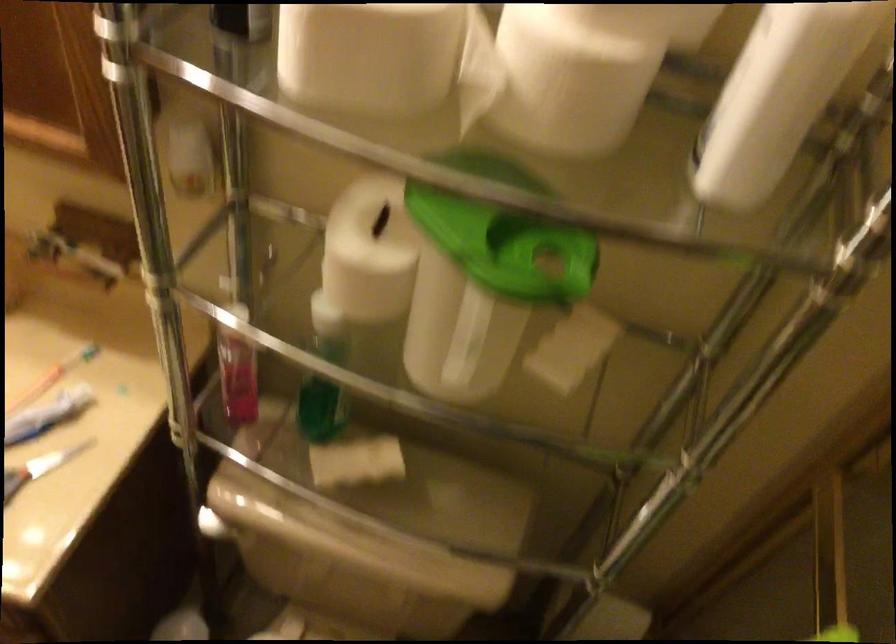
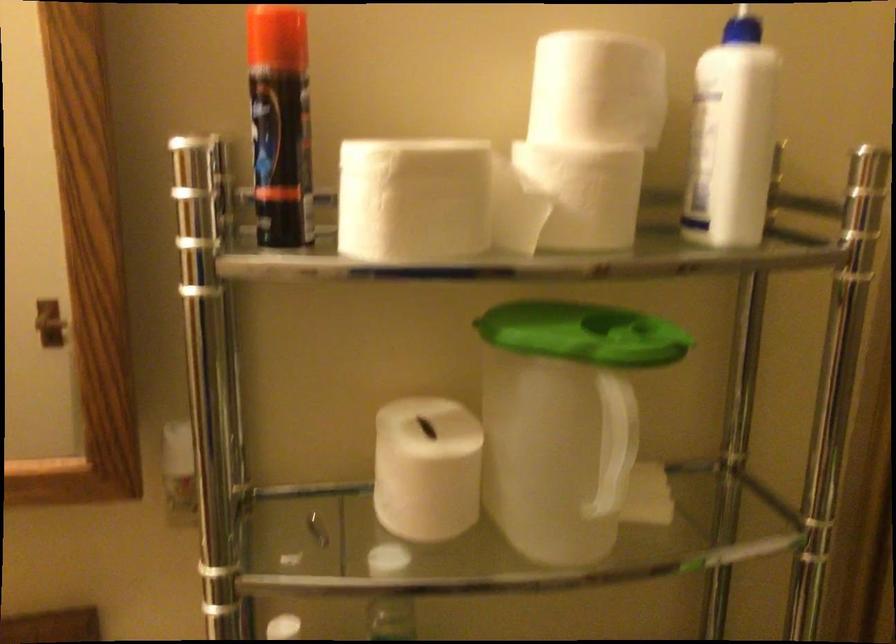
The point at (765, 68) is marked in the first image. Where is the corresponding point in the second image?

(731, 137)